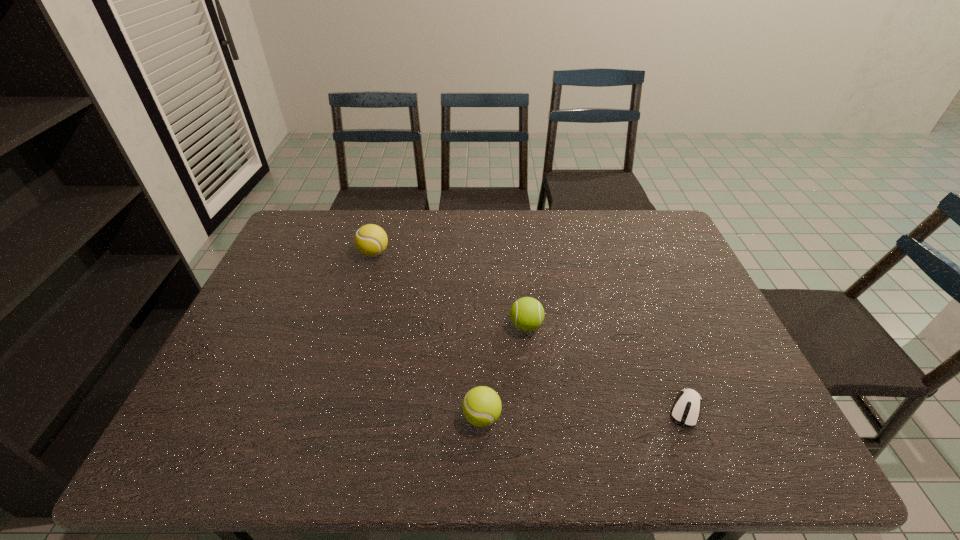
Identify the location of free space at the right edge. (686, 287).

What are the coordinates of `free space at the far left corner` in the screenshot? It's located at [294, 227].

The width and height of the screenshot is (960, 540). In order to click on vacant space at the near right corner of the desktop in this screenshot , I will do `click(749, 457)`.

In order to click on empty location between the farthest object and the second object from right to left in this screenshot , I will do `click(450, 289)`.

Where is `vacant region between the leftmost tennis ball and the second tennis ball from left to right`? vacant region between the leftmost tennis ball and the second tennis ball from left to right is located at coordinates (428, 335).

The width and height of the screenshot is (960, 540). In order to click on vacant point located between the third nearest object and the farthest tennis ball in this screenshot , I will do `click(450, 289)`.

Locate an element on the screen. empty space that is in between the rightmost object and the leftmost object is located at coordinates (530, 331).

Locate an element on the screen. The height and width of the screenshot is (540, 960). unoccupied position between the second tennis ball from right to left and the farthest object is located at coordinates (428, 335).

In order to click on vacant space in between the mouse and the farthest tennis ball in this screenshot , I will do `click(530, 331)`.

Image resolution: width=960 pixels, height=540 pixels. Find the location of `free spot between the third object from right to left and the third nearest object`. free spot between the third object from right to left and the third nearest object is located at coordinates (504, 372).